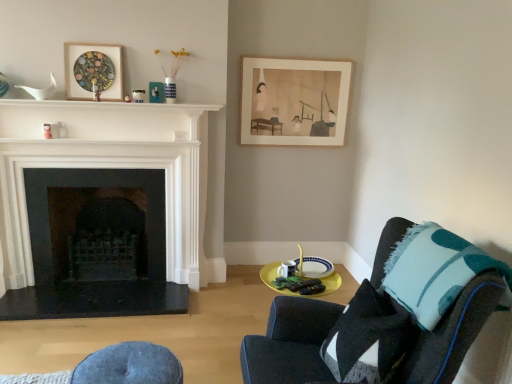
Question: Is teal felt throw pillow at right next to white ceramic plate at lower center?

Choices:
 (A) yes
 (B) no

Answer: (B)

Question: Does teal felt throw pillow at right have a greater width compared to white ceramic plate at lower center?

Choices:
 (A) yes
 (B) no

Answer: (A)

Question: From a real-world perspective, is teal felt throw pillow at right physically above white ceramic plate at lower center?

Choices:
 (A) no
 (B) yes

Answer: (B)

Question: Is teal felt throw pillow at right at the left side of white ceramic plate at lower center?

Choices:
 (A) no
 (B) yes

Answer: (A)

Question: Does teal felt throw pillow at right have a lesser width compared to white ceramic plate at lower center?

Choices:
 (A) yes
 (B) no

Answer: (B)

Question: Is teal felt throw pillow at right outside white ceramic plate at lower center?

Choices:
 (A) no
 (B) yes

Answer: (B)

Question: Can you confirm if denim cushion at lower center is taller than teal felt throw pillow at right?

Choices:
 (A) no
 (B) yes

Answer: (A)

Question: Does denim cushion at lower center turn towards teal felt throw pillow at right?

Choices:
 (A) no
 (B) yes

Answer: (A)

Question: Does denim cushion at lower center have a lesser width compared to teal felt throw pillow at right?

Choices:
 (A) yes
 (B) no

Answer: (B)

Question: From the image's perspective, does denim cushion at lower center appear lower than teal felt throw pillow at right?

Choices:
 (A) yes
 (B) no

Answer: (A)

Question: From the image's perspective, is denim cushion at lower center over teal felt throw pillow at right?

Choices:
 (A) yes
 (B) no

Answer: (B)

Question: From a real-world perspective, is denim cushion at lower center below teal felt throw pillow at right?

Choices:
 (A) yes
 (B) no

Answer: (A)

Question: Is teal felt throw pillow at right next to wooden stained picture frame at upper left, arranged as the 3th picture frame when viewed from the back?

Choices:
 (A) no
 (B) yes

Answer: (A)